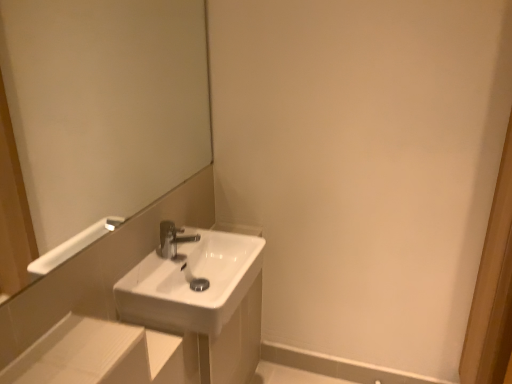
Question: Choose the correct answer: Is white glossy mirror at upper left inside white glossy sink at center or outside it?

Choices:
 (A) inside
 (B) outside

Answer: (B)

Question: In terms of height, does white glossy mirror at upper left look taller or shorter compared to white glossy sink at center?

Choices:
 (A) short
 (B) tall

Answer: (B)

Question: From the image's perspective, is white glossy mirror at upper left above or below white glossy sink at center?

Choices:
 (A) below
 (B) above

Answer: (B)

Question: In the image, is white glossy sink at center positioned in front of or behind white glossy mirror at upper left?

Choices:
 (A) behind
 (B) front

Answer: (A)

Question: In terms of width, does white glossy sink at center look wider or thinner when compared to white glossy mirror at upper left?

Choices:
 (A) thin
 (B) wide

Answer: (B)

Question: From the image's perspective, relative to white glossy mirror at upper left, is white glossy sink at center above or below?

Choices:
 (A) above
 (B) below

Answer: (B)

Question: Choose the correct answer: Is white glossy sink at center inside white glossy mirror at upper left or outside it?

Choices:
 (A) outside
 (B) inside

Answer: (A)